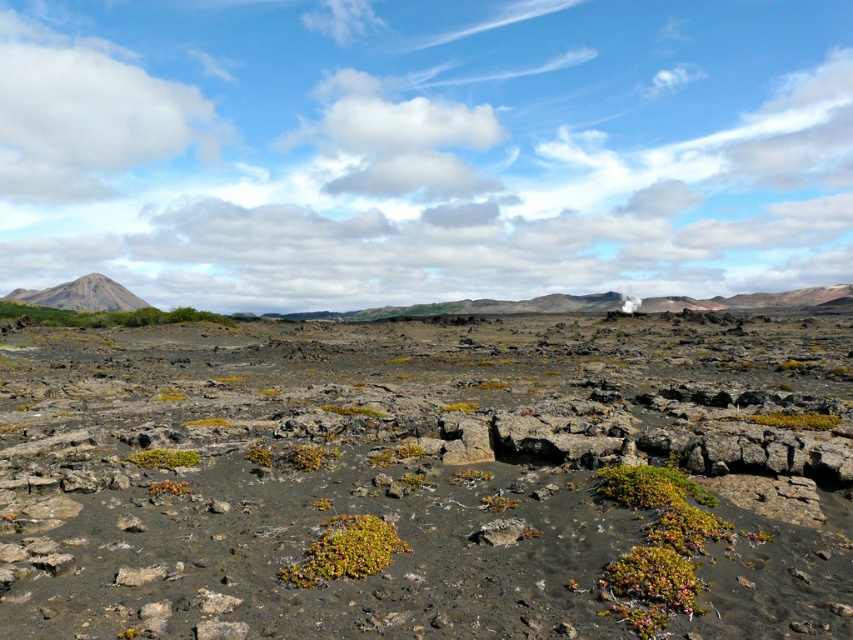
You are an astronaut on a mission to collect samples from the barren landscape. You need to choose between the dull gray rock at center and the green mossy mat at lower left. Which object should you prioritize for collection based on their sizes?

The dull gray rock at center is bigger than the green mossy mat at lower left, so you should prioritize collecting the dull gray rock at center since it is larger and may provide more samples.

You are a hiker who wants to take a photo of the green mossy rock at center and the green mossy shrub at center. Which one should you stand closer to in order to capture both in a single frame without zooming in?

The green mossy rock at center is much taller than the green mossy shrub at center, so you should stand closer to the green mossy shrub at center to include both in the frame without zooming.

You are an astronaut exploring this barren landscape and need to collect samples. You see the green mossy rock at center and the green mossy shrub at center. Which object is closer to the ground?

The green mossy rock at center is positioned under the green mossy shrub at center, so it is closer to the ground.